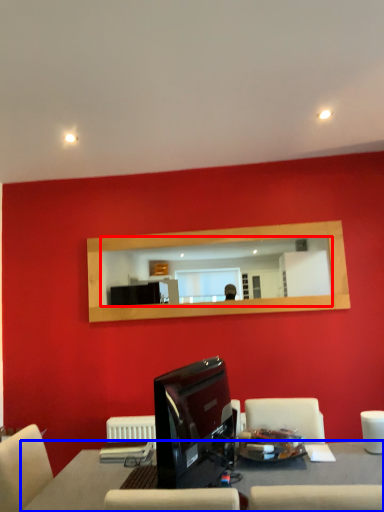
Question: Which of the following is the closest to the observer, mirror (highlighted by a red box) or table (highlighted by a blue box)?

Choices:
 (A) mirror
 (B) table

Answer: (B)